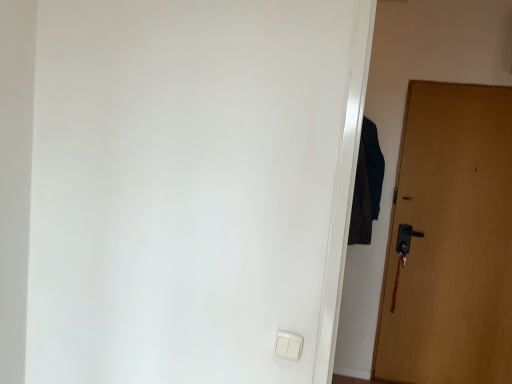
Find the location of a particular element. white plastic light switch at lower center is located at coordinates (288, 345).

Where is `wooden door at right`? The width and height of the screenshot is (512, 384). wooden door at right is located at coordinates (450, 240).

Would you say dark blue fabric at right contains wooden door at right?

No, wooden door at right is located outside of dark blue fabric at right.

Is dark blue fabric at right oriented towards wooden door at right?

No, dark blue fabric at right does not turn towards wooden door at right.

Is dark blue fabric at right bigger or smaller than wooden door at right?

dark blue fabric at right is smaller than wooden door at right.

From the picture: Can you tell me how much dark blue fabric at right and white plastic light switch at lower center differ in facing direction?

The facing directions of dark blue fabric at right and white plastic light switch at lower center are 5.65 degrees apart.

Between point (354, 238) and point (291, 333), which one is positioned in front?

The point (291, 333) is more forward.

Considering the relative sizes of dark blue fabric at right and white plastic light switch at lower center in the image provided, is dark blue fabric at right smaller than white plastic light switch at lower center?

Incorrect, dark blue fabric at right is not smaller in size than white plastic light switch at lower center.

Is dark blue fabric at right spatially inside white plastic light switch at lower center, or outside of it?

dark blue fabric at right is outside white plastic light switch at lower center.

Is there a large distance between white plastic light switch at lower center and dark blue fabric at right?

Yes, white plastic light switch at lower center is far from dark blue fabric at right.

Is point (289, 351) positioned in front of point (378, 207)?

Yes, it is in front of point (378, 207).

Image resolution: width=512 pixels, height=384 pixels. Identify the location of robe above the white plastic light switch at lower center (from the image's perspective). (366, 185).

From the picture: Considering the relative sizes of white plastic light switch at lower center and dark blue fabric at right in the image provided, is white plastic light switch at lower center taller than dark blue fabric at right?

No, white plastic light switch at lower center is not taller than dark blue fabric at right.

In the scene shown: Could you tell me if wooden door at right is facing white plastic light switch at lower center?

No, wooden door at right is not aimed at white plastic light switch at lower center.

Between wooden door at right and white plastic light switch at lower center, which one has more height?

Standing taller between the two is wooden door at right.

Does wooden door at right have a lesser width compared to white plastic light switch at lower center?

In fact, wooden door at right might be wider than white plastic light switch at lower center.

Would you say wooden door at right is a long distance from white plastic light switch at lower center?

wooden door at right is positioned a significant distance from white plastic light switch at lower center.

Is wooden door at right at the back of white plastic light switch at lower center?

No, white plastic light switch at lower center is not facing away from wooden door at right.

Is white plastic light switch at lower center at the left side of wooden door at right?

Correct, you'll find white plastic light switch at lower center to the left of wooden door at right.

From a real-world perspective, who is located lower, white plastic light switch at lower center or wooden door at right?

white plastic light switch at lower center, from a real-world perspective.

How far apart are wooden door at right and dark blue fabric at right?

wooden door at right and dark blue fabric at right are 18.66 inches apart.

From the image's perspective, would you say wooden door at right is positioned over dark blue fabric at right?

No, from the image's perspective, wooden door at right is not above dark blue fabric at right.

Consider the image. Is wooden door at right to the right of dark blue fabric at right from the viewer's perspective?

Correct, you'll find wooden door at right to the right of dark blue fabric at right.

Which of these two, wooden door at right or dark blue fabric at right, is smaller?

dark blue fabric at right.

Locate an element on the screen. This screenshot has width=512, height=384. robe that is on the left side of wooden door at right is located at coordinates [366, 185].

The width and height of the screenshot is (512, 384). In order to click on robe that is above the white plastic light switch at lower center (from a real-world perspective) in this screenshot , I will do `click(366, 185)`.

Which object lies nearer to the anchor point white plastic light switch at lower center, wooden door at right or dark blue fabric at right?

The object closer to white plastic light switch at lower center is dark blue fabric at right.

From the image, which object appears to be farther from white plastic light switch at lower center, dark blue fabric at right or wooden door at right?

wooden door at right is further to white plastic light switch at lower center.

Which object lies nearer to the anchor point dark blue fabric at right, white plastic light switch at lower center or wooden door at right?

The object closer to dark blue fabric at right is wooden door at right.

When comparing their distances from dark blue fabric at right, does wooden door at right or white plastic light switch at lower center seem further?

Among the two, white plastic light switch at lower center is located further to dark blue fabric at right.

When comparing their distances from wooden door at right, does dark blue fabric at right or white plastic light switch at lower center seem closer?

Among the two, dark blue fabric at right is located nearer to wooden door at right.

Based on the photo, estimate the real-world distances between objects in this image. Which object is closer to wooden door at right, white plastic light switch at lower center or dark blue fabric at right?

Among the two, dark blue fabric at right is located nearer to wooden door at right.

The height and width of the screenshot is (384, 512). I want to click on robe between white plastic light switch at lower center and wooden door at right in the front-back direction, so click(x=366, y=185).